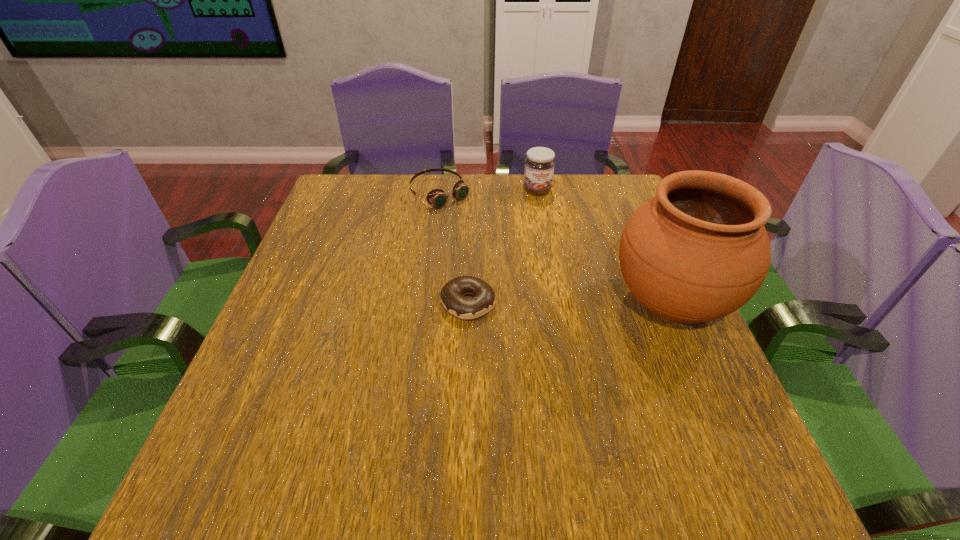
What are the coordinates of `vacant spot on the desktop that is between the doughnut and the tallest object and is positioned on the front label of the jam` in the screenshot? It's located at (579, 303).

The height and width of the screenshot is (540, 960). Identify the location of vacant space on the desktop that is between the shortest object and the rightmost object and is positioned through the lenses of the third tallest object. (564, 303).